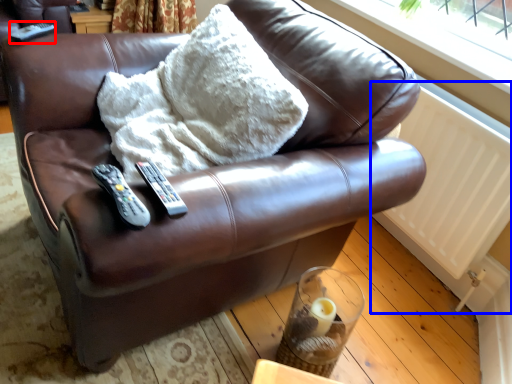
Question: Which point is further to the camera, remote (highlighted by a red box) or radiator (highlighted by a blue box)?

Choices:
 (A) remote
 (B) radiator

Answer: (A)